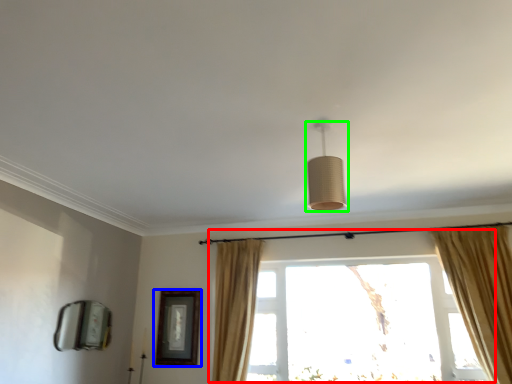
Question: Based on their relative distances, which object is nearer to window (highlighted by a red box)? Choose from picture frame (highlighted by a blue box) and lamp (highlighted by a green box).

Choices:
 (A) picture frame
 (B) lamp

Answer: (A)